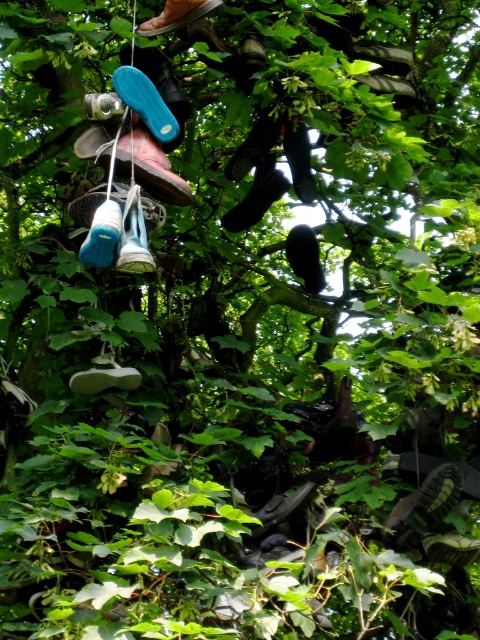
Can you confirm if blue suede shoe at upper left is thinner than white matte shoe at center?

No, blue suede shoe at upper left is not thinner than white matte shoe at center.

Is blue suede shoe at upper left positioned before white matte shoe at center?

Yes.

Image resolution: width=480 pixels, height=640 pixels. What are the coordinates of `blue suede shoe at upper left` in the screenshot? It's located at (156, 168).

At what (x,y) coordinates should I click in order to perform the action: click on blue suede shoe at upper left. Please return your answer as a coordinate pair (x, y). Image resolution: width=480 pixels, height=640 pixels. Looking at the image, I should click on (156, 168).

Between blue suede shoe at upper left and blue suede shoe at center, which one is positioned higher?

blue suede shoe at upper left is higher up.

Can you confirm if blue suede shoe at upper left is positioned to the right of blue suede shoe at center?

In fact, blue suede shoe at upper left is to the left of blue suede shoe at center.

The image size is (480, 640). What do you see at coordinates (156, 168) in the screenshot?
I see `blue suede shoe at upper left` at bounding box center [156, 168].

The image size is (480, 640). What are the coordinates of `blue suede shoe at upper left` in the screenshot? It's located at (156, 168).

Between point (132, 195) and point (123, 388), which one is positioned in front?

Point (132, 195) is more forward.

Can you confirm if blue suede shoe at center is shorter than white matte shoe at center?

A: Incorrect, blue suede shoe at center's height does not fall short of white matte shoe at center's.

This screenshot has height=640, width=480. What are the coordinates of `blue suede shoe at center` in the screenshot? It's located at (133, 236).